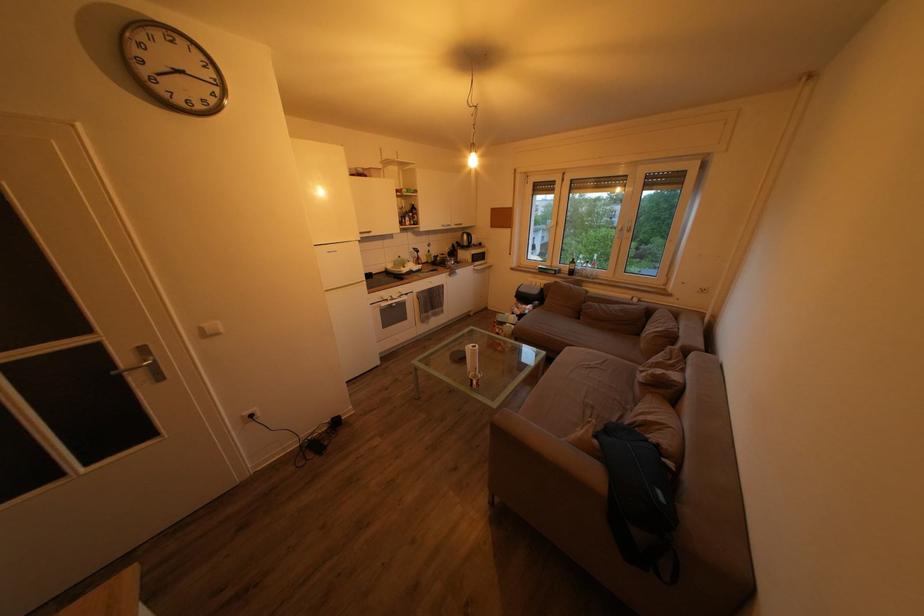
The height and width of the screenshot is (616, 924). What are the coordinates of `sofa armrest` in the screenshot? It's located at (541, 469).